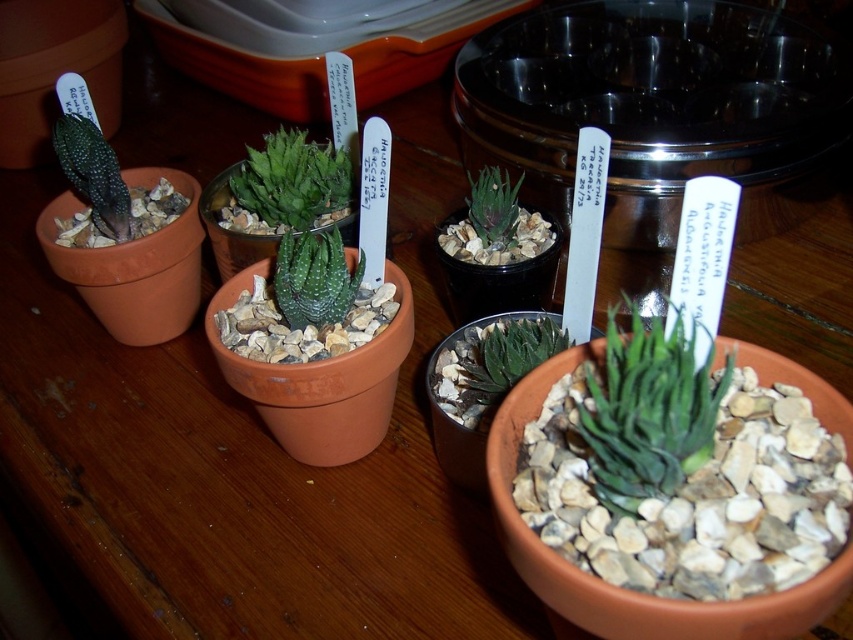
Please provide the exact 2D coordinates of the green matte succulent at center in the image coordinate system where the origin is at the bottom left corner.

The green matte succulent at center is located at coordinates 0.641 in the x axis and 0.762 in the y axis.

You are arranging plants in a garden and need to place the green matte succulent at center and the green succulent at center. According to the image, which one is positioned to the right?

The green matte succulent at center is positioned to the right of the green succulent at center.